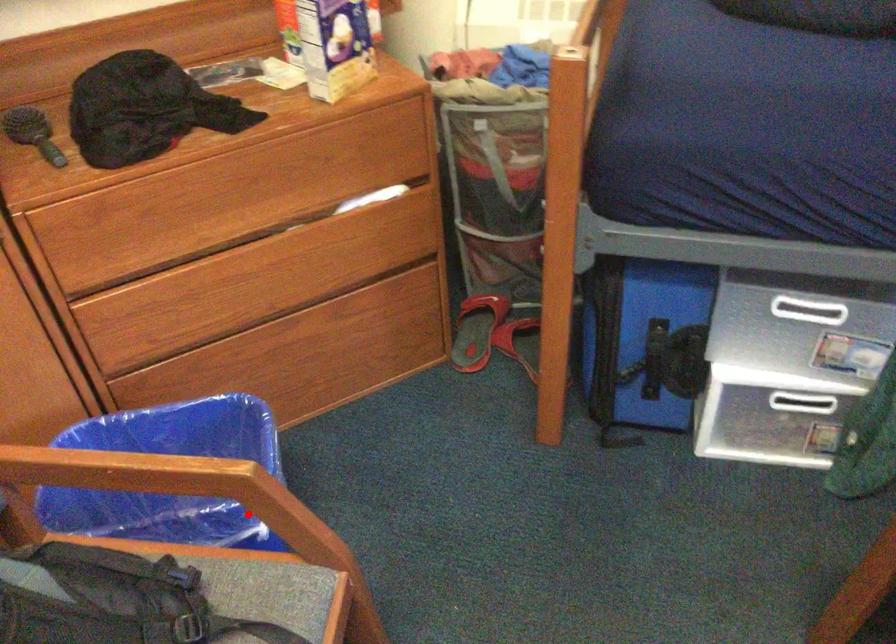
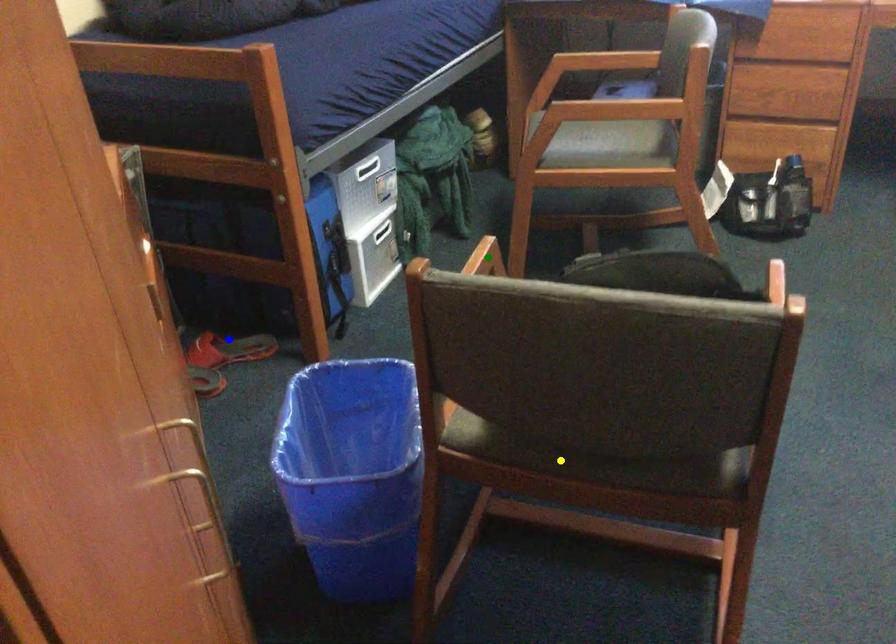
Question: I am providing you with two images of the same scene from different viewpoints. A red point is marked on the first image. You are given multiple points on the second image. Which point in image 2 is actually the same real-world point as the red point in image 1?

Choices:
 (A) blue point
 (B) green point
 (C) yellow point

Answer: (B)